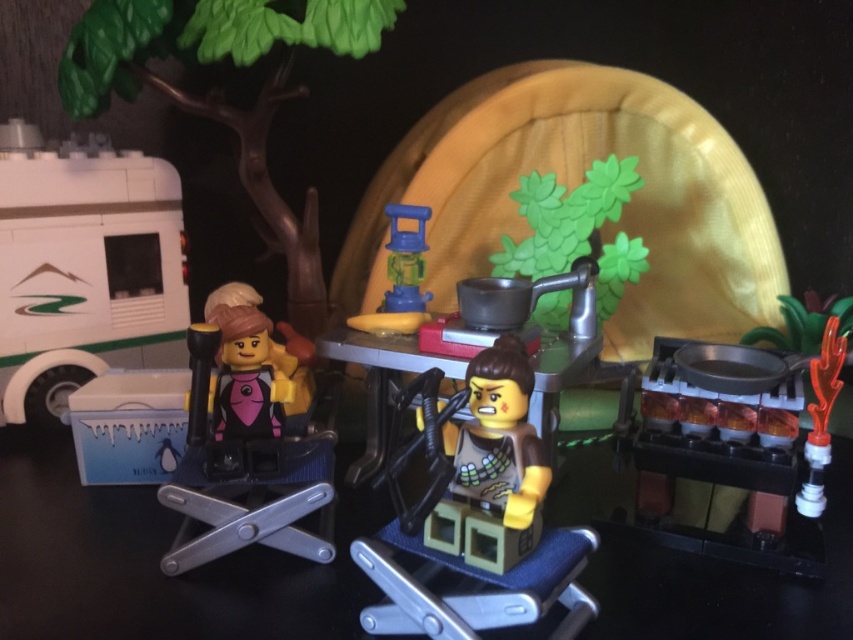
Question: Is the position of matte brown minifigure at center more distant than that of translucent blue plastic lantern at center?

Choices:
 (A) yes
 (B) no

Answer: (B)

Question: Which of these objects is positioned farthest from the matte black minifigure at center?

Choices:
 (A) matte brown minifigure at center
 (B) smooth wooden table at center
 (C) matte gray minifigure at center
 (D) translucent orange plastic at right

Answer: (D)

Question: Which of the following is the farthest from the observer?

Choices:
 (A) (469, 388)
 (B) (833, 365)

Answer: (B)

Question: Among these points, which one is farthest from the camera?

Choices:
 (A) (515, 483)
 (B) (370, 420)
 (C) (418, 305)
 (D) (460, 534)

Answer: (C)

Question: Does matte gray minifigure at center appear on the right side of smooth wooden table at center?

Choices:
 (A) no
 (B) yes

Answer: (B)

Question: Can you confirm if white plastic recreational vehicle at left is wider than matte black minifigure at center?

Choices:
 (A) yes
 (B) no

Answer: (A)